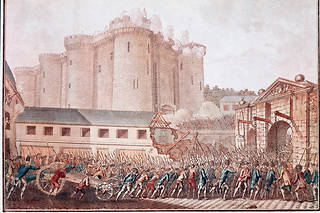
Identify the location of windows. This screenshot has height=213, width=320. (30, 129), (47, 132), (62, 130), (85, 131), (103, 133), (121, 132), (140, 134), (136, 85), (128, 48), (98, 71).